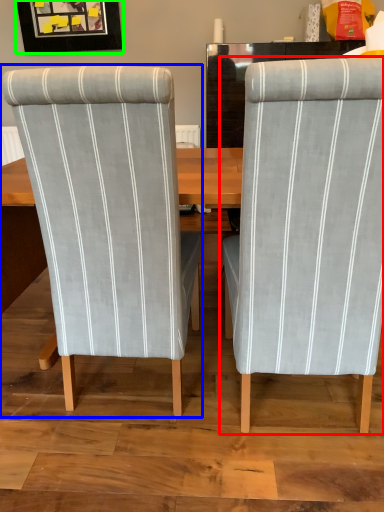
Question: Which object is positioned farthest from chair (highlighted by a red box)? Select from chair (highlighted by a blue box) and picture frame (highlighted by a green box).

Choices:
 (A) chair
 (B) picture frame

Answer: (B)